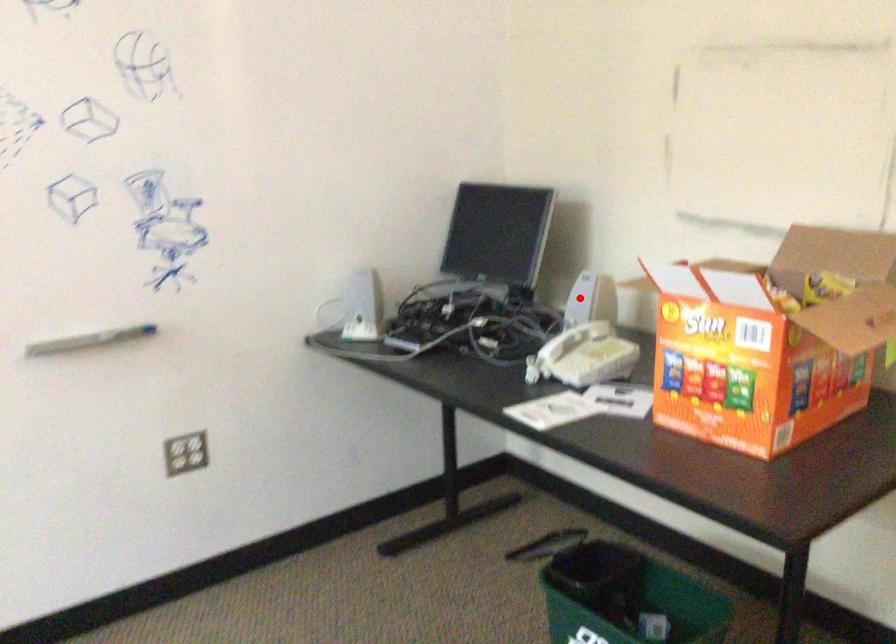
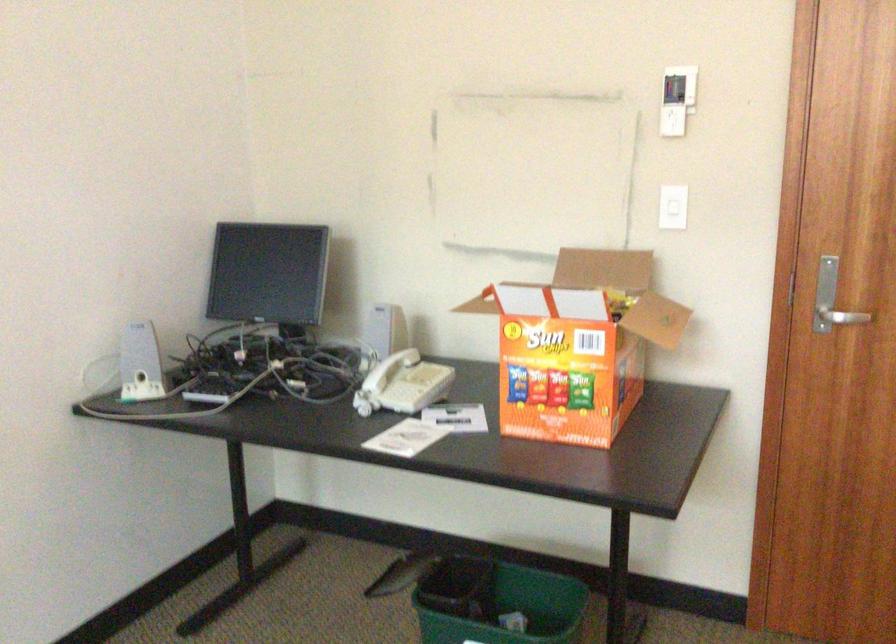
Where in the second image is the point corresponding to the highlighted location from the first image?

(384, 328)